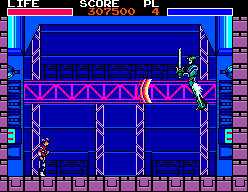
The width and height of the screenshot is (248, 192). In order to click on left wall border in this screenshot , I will do [4, 88].